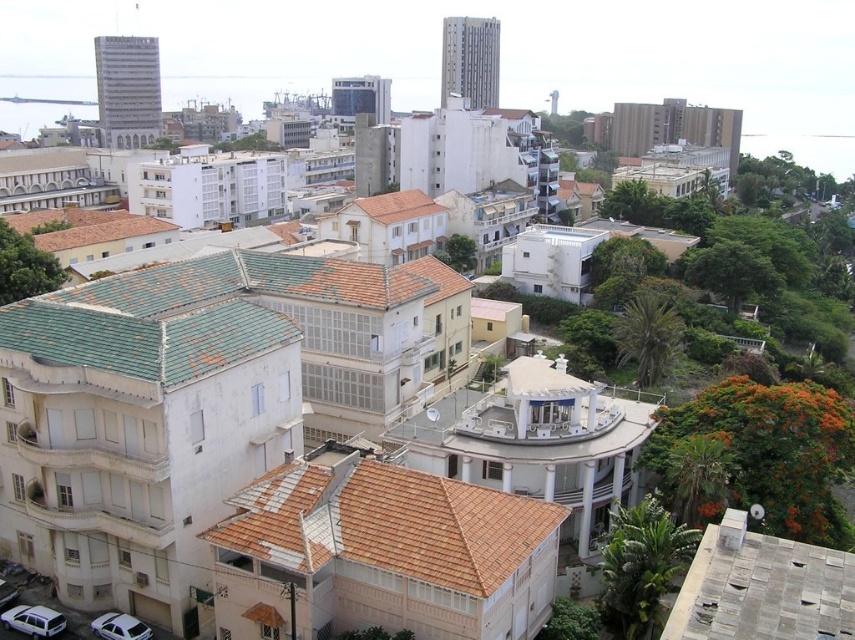
You are a pedestrian standing at the edge of the road in the image. You see a white matte station wagon at lower left and a white glossy car at lower left. Which one is positioned more to the left side?

The white matte station wagon at lower left is positioned more to the left side than the white glossy car at lower left.

You are a delivery driver who needs to park your vehicle in a narrow alley between the buildings. Your vehicle is 1.8 meters wide. The white matte station wagon at lower left and the white glossy car at lower left are already parked there. Can you determine if your vehicle can fit between them based on their widths?

The white matte station wagon at lower left might be wider than white glossy car at lower left. Since the exact width difference isn t specified, it s uncertain whether there s enough space for your 1.8 meter wide vehicle. You should measure the gap before proceeding.

You are a delivery driver trying to park your vehicle in a narrow alley between the buildings. Your vehicle is the white glossy car at lower left. The alley has a height restriction of 1.8 meters. Can you safely park your car there if there is also a white matte station wagon at lower left parked nearby?

The white matte station wagon at lower left is taller than the white glossy car at lower left. Since the station wagon can already park there without issue, the white glossy car at lower left, being shorter, should also be able to fit under the 1.8 meter height restriction.